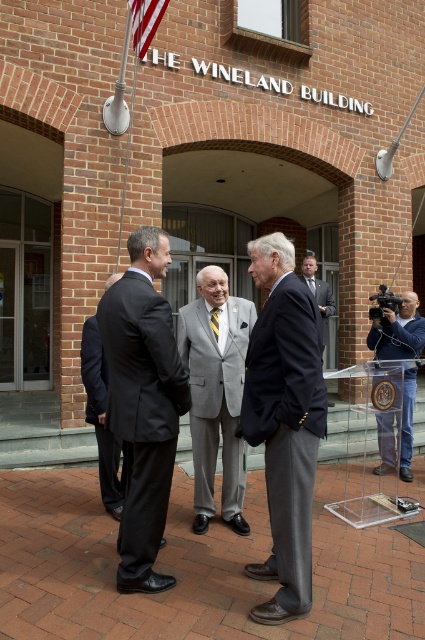
Which is more to the left, navy blue suit at center or blue denim jeans at lower right?

navy blue suit at center is more to the left.

Between navy blue suit at center and blue denim jeans at lower right, which one has less height?

Standing shorter between the two is blue denim jeans at lower right.

Between point (269, 577) and point (404, 336), which one is positioned in front?

Point (269, 577) is more forward.

Locate an element on the screen. navy blue suit at center is located at coordinates (285, 420).

Who is shorter, navy blue suit at center or dark gray suit at center?

Standing shorter between the two is dark gray suit at center.

Does navy blue suit at center have a larger size compared to dark gray suit at center?

Correct, navy blue suit at center is larger in size than dark gray suit at center.

Where is `navy blue suit at center`? Image resolution: width=425 pixels, height=640 pixels. navy blue suit at center is located at coordinates (285, 420).

The height and width of the screenshot is (640, 425). Identify the location of navy blue suit at center. (285, 420).

Is matte black suit at center to the right of blue denim jeans at lower right from the viewer's perspective?

Incorrect, matte black suit at center is not on the right side of blue denim jeans at lower right.

Is matte black suit at center thinner than blue denim jeans at lower right?

Yes, matte black suit at center is thinner than blue denim jeans at lower right.

Is point (108, 403) closer to viewer compared to point (379, 337)?

That is True.

This screenshot has width=425, height=640. I want to click on matte black suit at center, so click(x=142, y=403).